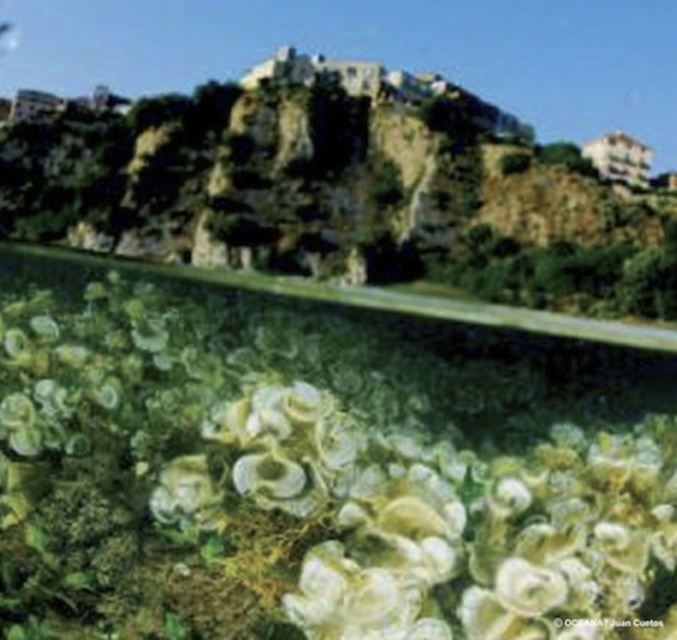
Does white matte coral at center appear under brown rocky hillside at upper center?

Correct, white matte coral at center is located below brown rocky hillside at upper center.

Is white matte coral at center bigger than brown rocky hillside at upper center?

No, white matte coral at center is not bigger than brown rocky hillside at upper center.

Does point (200, 301) lie behind point (1, 141)?

No, it is in front of (1, 141).

You are a GUI agent. You are given a task and a screenshot of the screen. Output one action in this format:
    pyautogui.click(x=<x>, y=<y>)
    Task: Click on the white matte coral at center
    
    Given the screenshot: What is the action you would take?
    pyautogui.click(x=324, y=472)